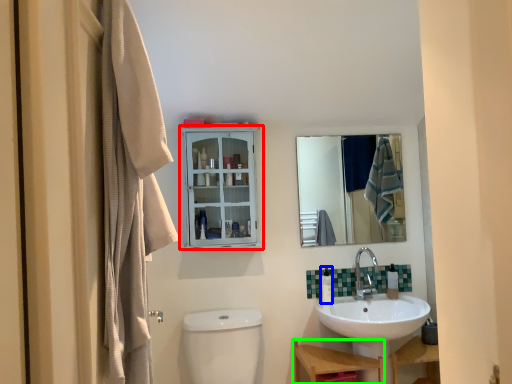
Question: Estimate the real-world distances between objects in this image. Which object is closer to cabinetry (highlighted by a red box), toiletry (highlighted by a blue box) or furniture (highlighted by a green box)?

Choices:
 (A) toiletry
 (B) furniture

Answer: (A)